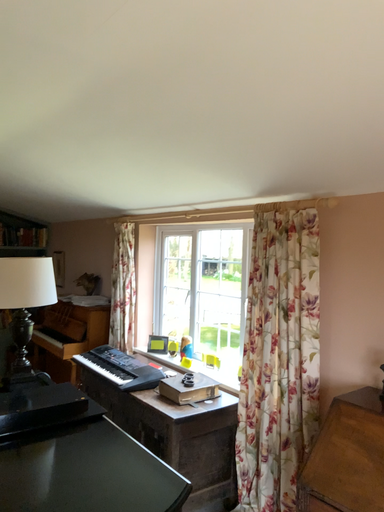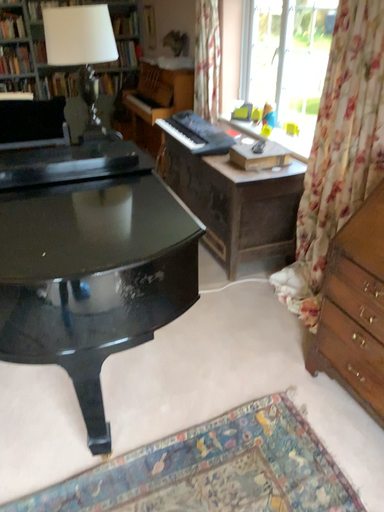
Question: Which way did the camera rotate in the video?

Choices:
 (A) rotated upward
 (B) rotated downward

Answer: (B)